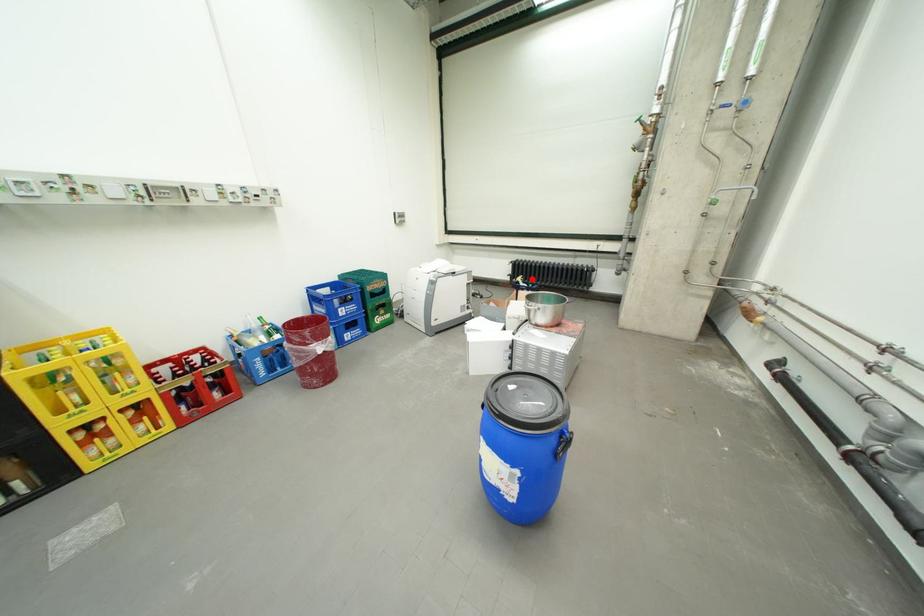
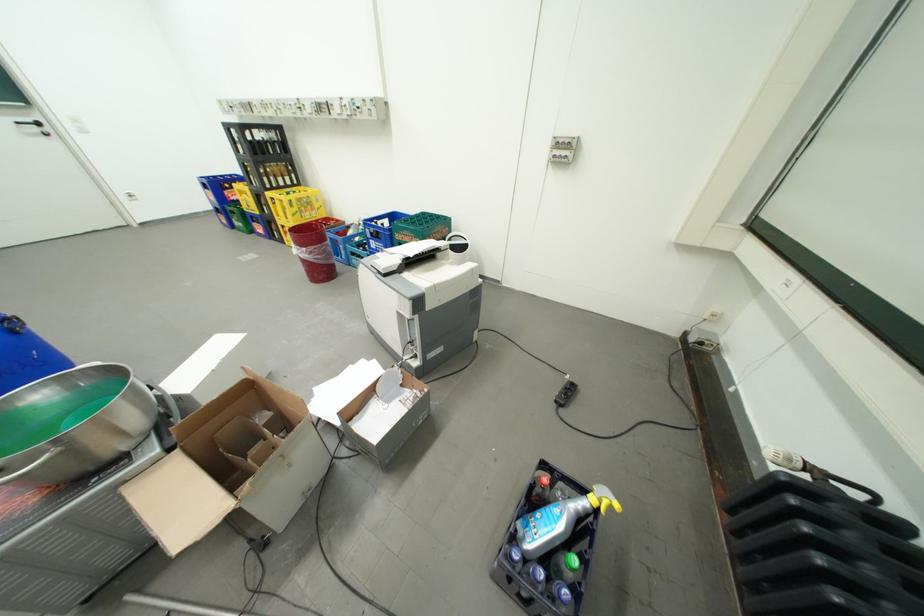
Question: I am providing you with two images of the same scene from different viewpoints. Given a red point in image1, look at the same physical point in image2. Is it:

Choices:
 (A) Closer to the viewpoint
 (B) Farther from the viewpoint

Answer: (A)